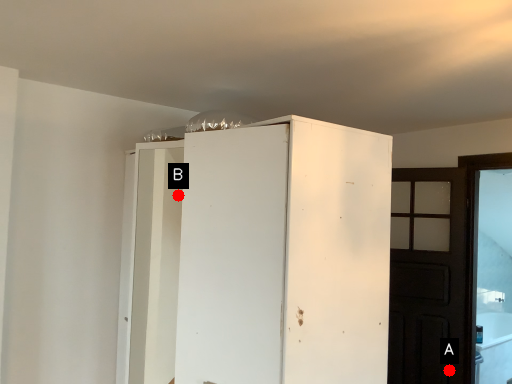
Question: Two points are circled on the image, labeled by A and B beside each circle. Which of the following is the closest to the observer?

Choices:
 (A) A is closer
 (B) B is closer

Answer: (A)